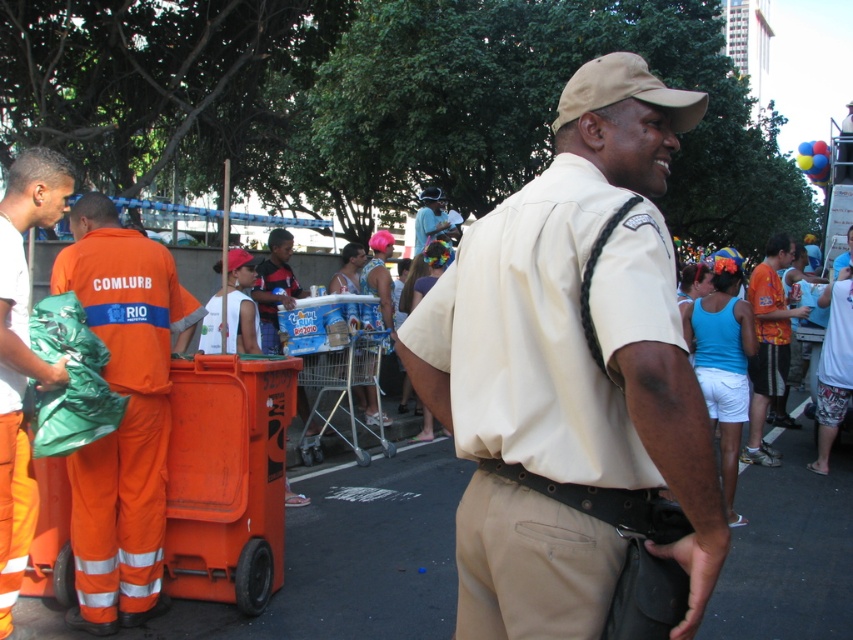
You are attending a festival and see the beige uniform at center and the white matte shirt at left. Which person is positioned more to the right?

The beige uniform at center is positioned more to the right than the white matte shirt at left.

You are observing a group of people in an outdoor event. You notice a beige uniform at center and a white matte shirt at left. Which person is smaller in size?

The beige uniform at center is smaller in size compared to the white matte shirt at left.